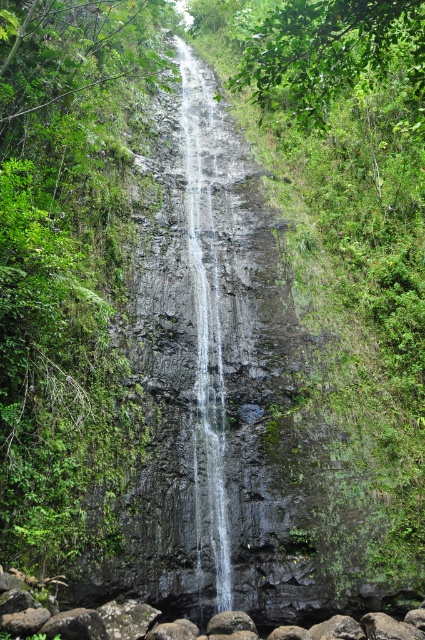
Question: Which object appears closest to the camera in this image?

Choices:
 (A) smooth gray rock at center
 (B) clear water at center

Answer: (A)

Question: Can you confirm if clear water at center is wider than smooth gray rock at center?

Choices:
 (A) yes
 (B) no

Answer: (B)

Question: Which object appears farthest from the camera in this image?

Choices:
 (A) smooth gray rock at center
 (B) clear water at center

Answer: (B)

Question: Is clear water at center to the left of smooth gray rock at center from the viewer's perspective?

Choices:
 (A) no
 (B) yes

Answer: (B)

Question: Does clear water at center appear on the right side of smooth gray rock at center?

Choices:
 (A) yes
 (B) no

Answer: (B)